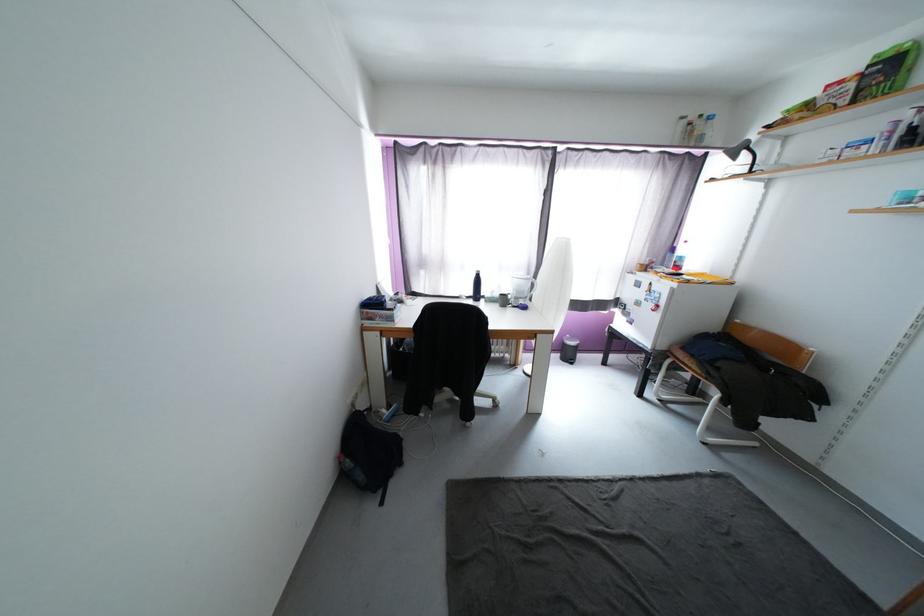
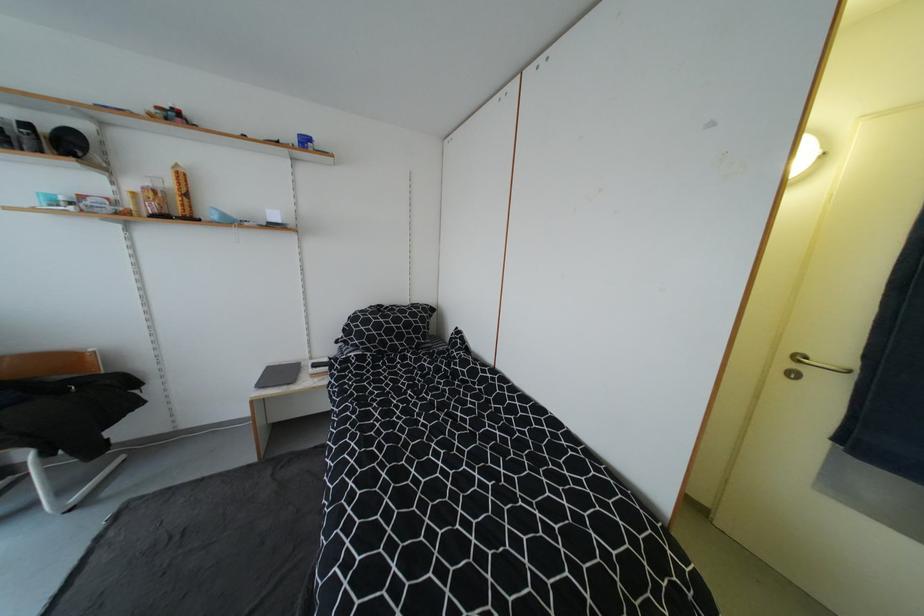
Where in the second image is the point corresponding to the point at 893,204 from the first image?

(43, 204)